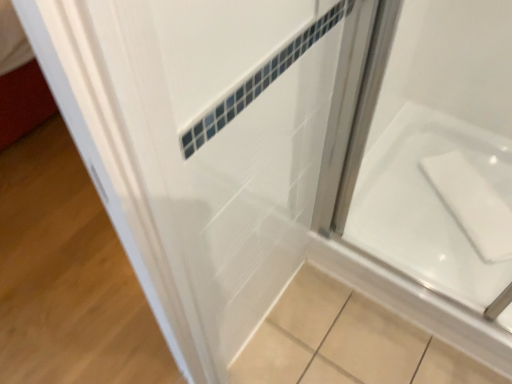
Question: Looking at the image, does white glossy bath at lower right seem bigger or smaller compared to white glossy door at upper left?

Choices:
 (A) small
 (B) big

Answer: (B)

Question: Is point (393, 221) closer or farther from the camera than point (224, 36)?

Choices:
 (A) farther
 (B) closer

Answer: (A)

Question: From a real-world perspective, relative to white glossy door at upper left, is white glossy bath at lower right vertically above or below?

Choices:
 (A) above
 (B) below

Answer: (A)

Question: Does point (113, 29) appear closer or farther from the camera than point (385, 155)?

Choices:
 (A) closer
 (B) farther

Answer: (A)

Question: Looking at their shapes, would you say white glossy door at upper left is wider or thinner than white glossy bath at lower right?

Choices:
 (A) thin
 (B) wide

Answer: (B)

Question: Visually, is white glossy door at upper left positioned to the left or to the right of white glossy bath at lower right?

Choices:
 (A) left
 (B) right

Answer: (A)

Question: Relative to white glossy bath at lower right, is white glossy door at upper left in front or behind?

Choices:
 (A) front
 (B) behind

Answer: (A)